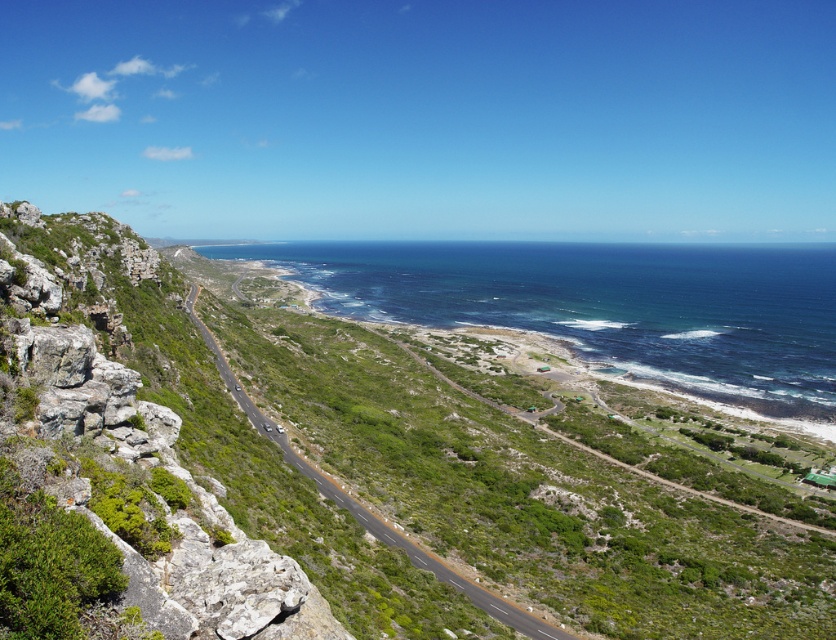
Is green mossy rock at left smaller than green grassy road at center?

Incorrect, green mossy rock at left is not smaller in size than green grassy road at center.

In the scene shown: Does green mossy rock at left appear under green grassy road at center?

No.

Which is in front, point (177, 468) or point (350, 497)?

Point (177, 468) is more forward.

Locate an element on the screen. This screenshot has width=836, height=640. green mossy rock at left is located at coordinates (111, 467).

Who is taller, green grassy hillside at lower left or green grassy road at center?

Standing taller between the two is green grassy hillside at lower left.

Can you confirm if green grassy hillside at lower left is positioned to the right of green grassy road at center?

Indeed, green grassy hillside at lower left is positioned on the right side of green grassy road at center.

Identify the location of green grassy hillside at lower left. The height and width of the screenshot is (640, 836). (350, 467).

Is green grassy hillside at lower left taller than green mossy rock at left?

Yes.

Locate an element on the screen. This screenshot has width=836, height=640. green grassy hillside at lower left is located at coordinates (350, 467).

The image size is (836, 640). Find the location of `green grassy hillside at lower left`. green grassy hillside at lower left is located at coordinates (350, 467).